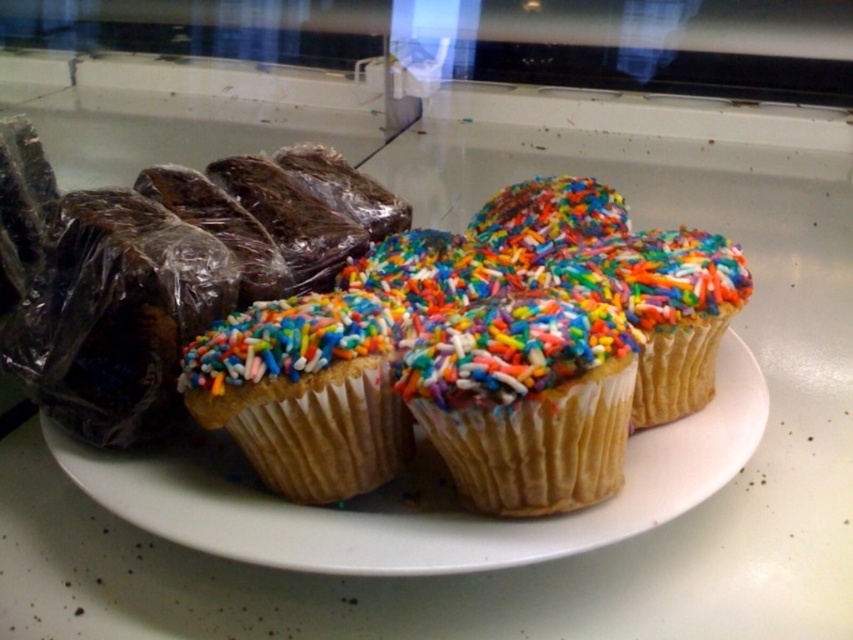
Question: Does white paper cupcake with colorful sprinkles at center appear on the left side of multicolored sprinkles cupcake at center?

Choices:
 (A) no
 (B) yes

Answer: (B)

Question: Which point is closer to the camera?

Choices:
 (A) white paper cupcake with colorful sprinkles at center
 (B) multicolored sprinkles cupcake at center

Answer: (B)

Question: In this image, where is white paper cupcake with colorful sprinkles at center located relative to multicolored sprinkles cupcake at center?

Choices:
 (A) above
 (B) below

Answer: (A)

Question: Which point is farther to the camera?

Choices:
 (A) (467, 401)
 (B) (180, 364)

Answer: (B)

Question: Which point appears closest to the camera in this image?

Choices:
 (A) (508, 401)
 (B) (224, 420)

Answer: (A)

Question: Does white paper cupcake with colorful sprinkles at center appear on the right side of matte paper cupcake at center?

Choices:
 (A) yes
 (B) no

Answer: (A)